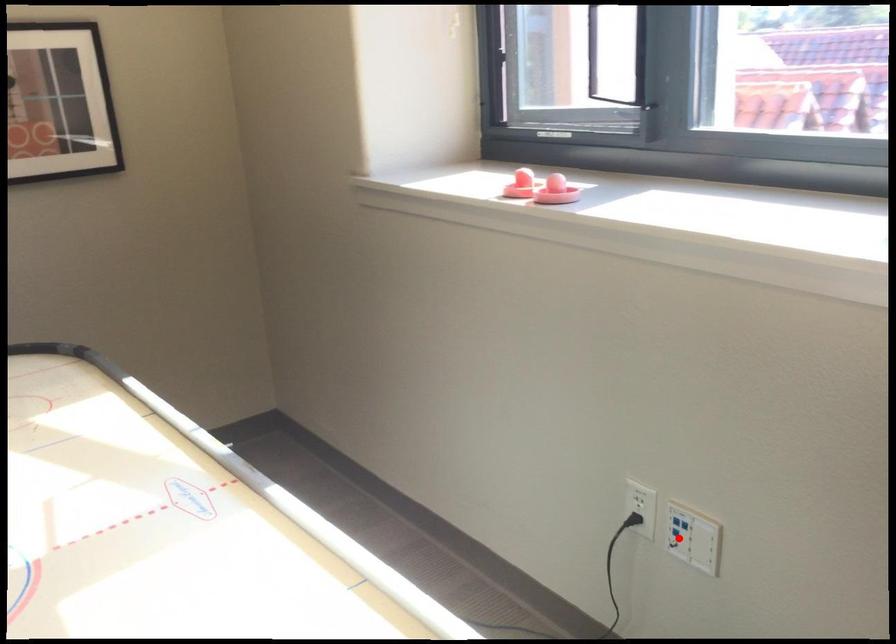
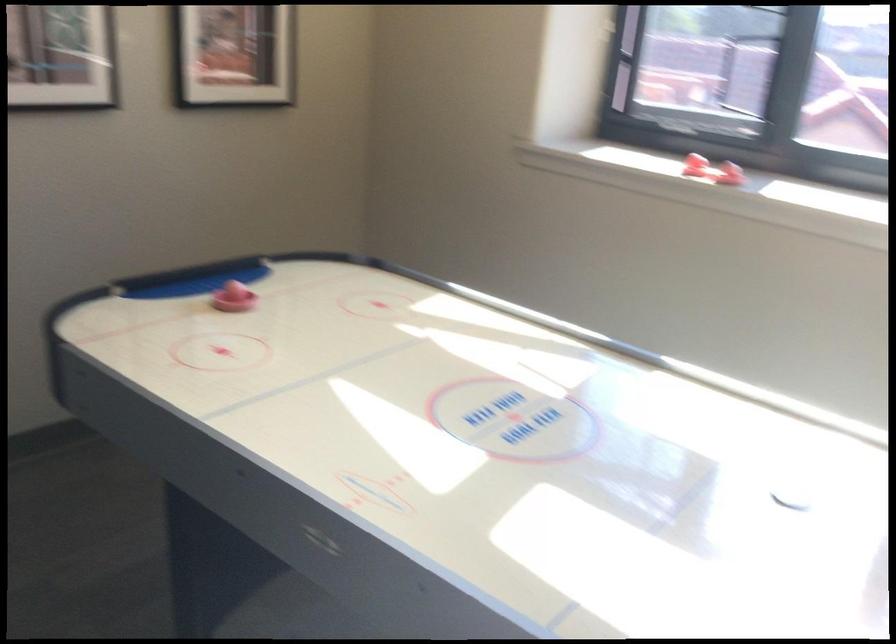
Question: I am providing you with two images of the same scene from different viewpoints. A red point is marked on the first image. At the location where the point appears in image 1, is it still visible in image 2?

Choices:
 (A) Yes
 (B) No

Answer: (B)